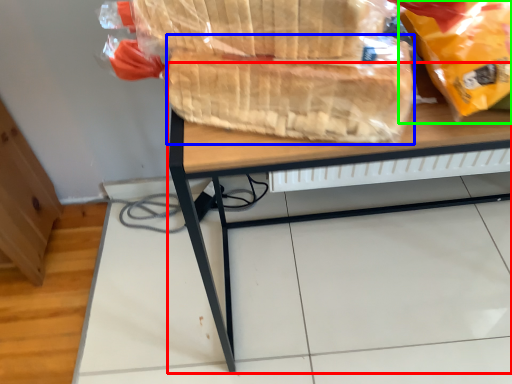
Question: Based on their relative distances, which object is nearer to desk (highlighted by a red box)? Choose from bread (highlighted by a blue box) and plastic bag (highlighted by a green box).

Choices:
 (A) bread
 (B) plastic bag

Answer: (A)